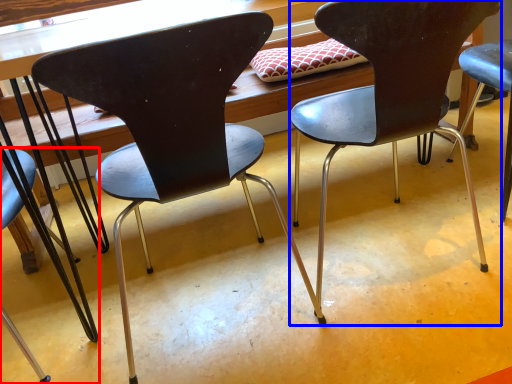
Question: Which point is further to the camera, chair (highlighted by a red box) or chair (highlighted by a blue box)?

Choices:
 (A) chair
 (B) chair

Answer: (A)